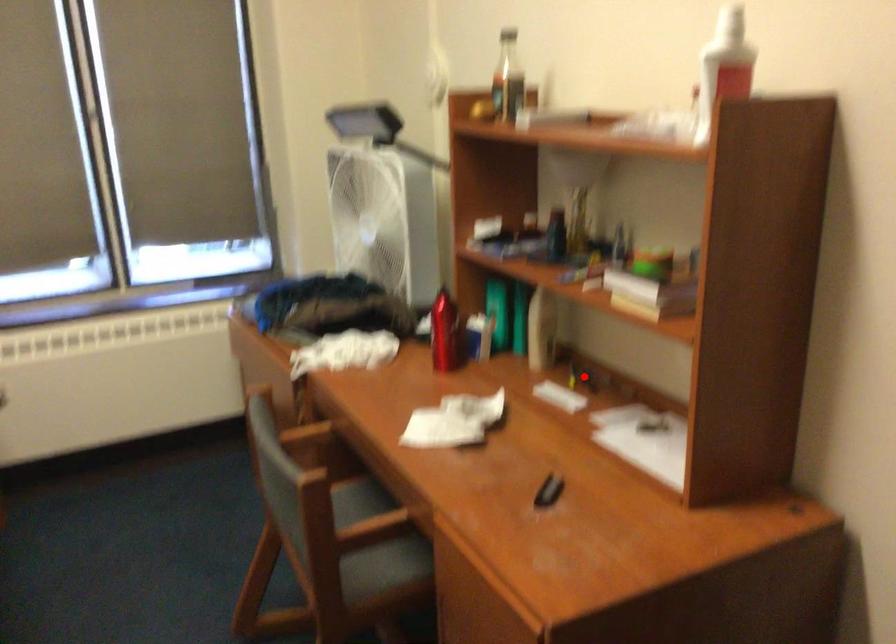
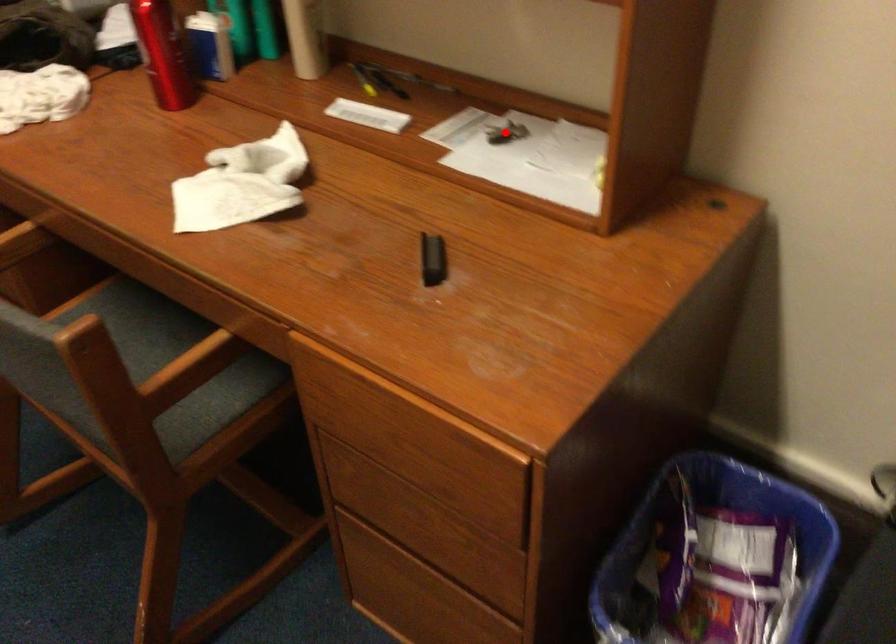
In the scene shown: I am providing you with two images of the same scene from different viewpoints. A red point is marked on the first image and another point is marked on the second image. Is the marked point in image1 the same physical position as the marked point in image2?

No